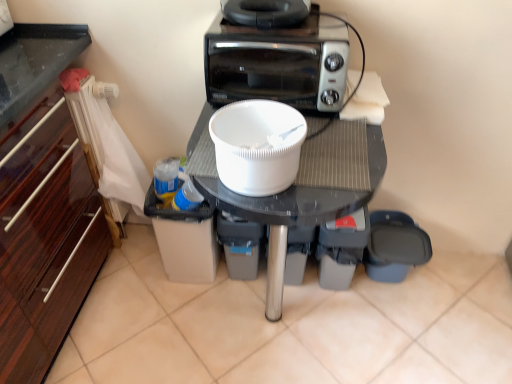
Locate an element on the screen. The image size is (512, 384). vacant space to the right of white plastic table at center is located at coordinates (417, 328).